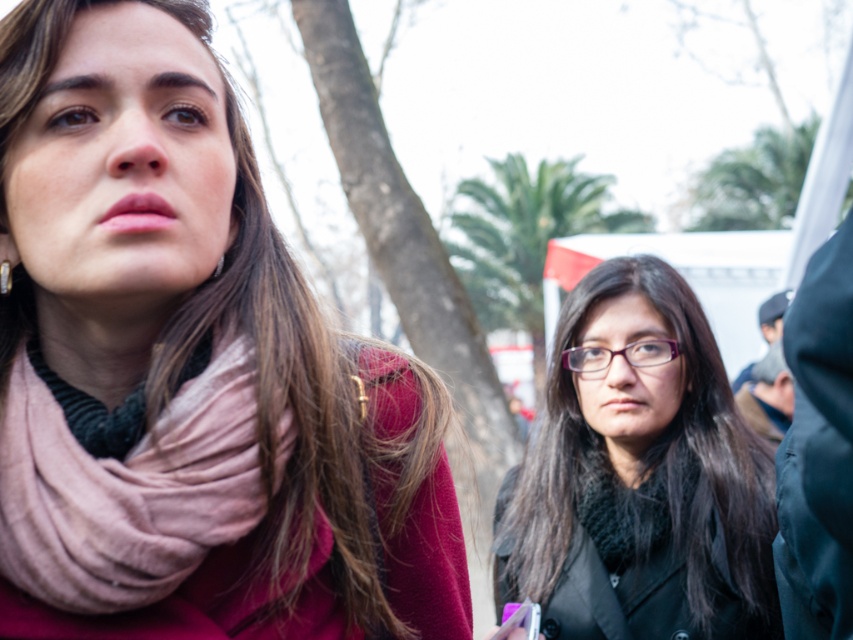
How much distance is there between black matte glasses at center and pink soft fabric scarf at left?

black matte glasses at center and pink soft fabric scarf at left are 1.21 meters apart from each other.

Image resolution: width=853 pixels, height=640 pixels. What do you see at coordinates (639, 476) in the screenshot? I see `black matte glasses at center` at bounding box center [639, 476].

Where is `black matte glasses at center`? This screenshot has width=853, height=640. black matte glasses at center is located at coordinates (639, 476).

Between pink fabric scarf at upper left and pink soft fabric scarf at left, which one is positioned lower?

pink soft fabric scarf at left is lower down.

Is point (310, 314) in front of point (12, 582)?

No.

Is point (39, 64) positioned before point (175, 563)?

No, (39, 64) is behind (175, 563).

You are a GUI agent. You are given a task and a screenshot of the screen. Output one action in this format:
    pyautogui.click(x=<x>, y=<y>)
    Task: Click on the pink fabric scarf at upper left
    This screenshot has width=853, height=640.
    Given the screenshot: What is the action you would take?
    pyautogui.click(x=189, y=369)

Does pink fabric scarf at upper left have a lesser height compared to black matte glasses at center?

Indeed, pink fabric scarf at upper left has a lesser height compared to black matte glasses at center.

Can you confirm if pink fabric scarf at upper left is positioned above black matte glasses at center?

Correct, pink fabric scarf at upper left is located above black matte glasses at center.

The height and width of the screenshot is (640, 853). Find the location of `pink fabric scarf at upper left`. pink fabric scarf at upper left is located at coordinates (189, 369).